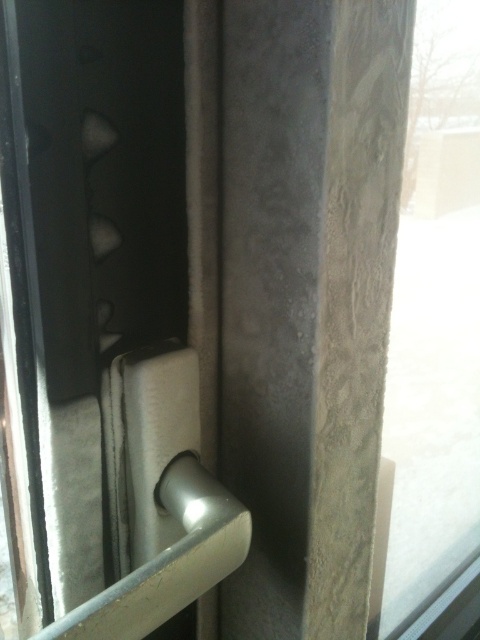
Question: In this image, where is sanded concrete pillar at center located relative to silver metallic door handle at center?

Choices:
 (A) below
 (B) above

Answer: (B)

Question: Which of the following is the farthest from the observer?

Choices:
 (A) silver metallic door handle at center
 (B) sanded concrete pillar at center
 (C) transparent glass window at right

Answer: (C)

Question: Does transparent glass window at right have a lesser width compared to silver metallic door handle at center?

Choices:
 (A) yes
 (B) no

Answer: (B)

Question: Does sanded concrete pillar at center appear under transparent glass window at right?

Choices:
 (A) yes
 (B) no

Answer: (A)

Question: Which of the following is the farthest from the observer?

Choices:
 (A) (168, 483)
 (B) (311, 116)
 (C) (417, 260)

Answer: (C)

Question: Which object is the closest to the transparent glass window at right?

Choices:
 (A) sanded concrete pillar at center
 (B) silver metallic door handle at center

Answer: (A)